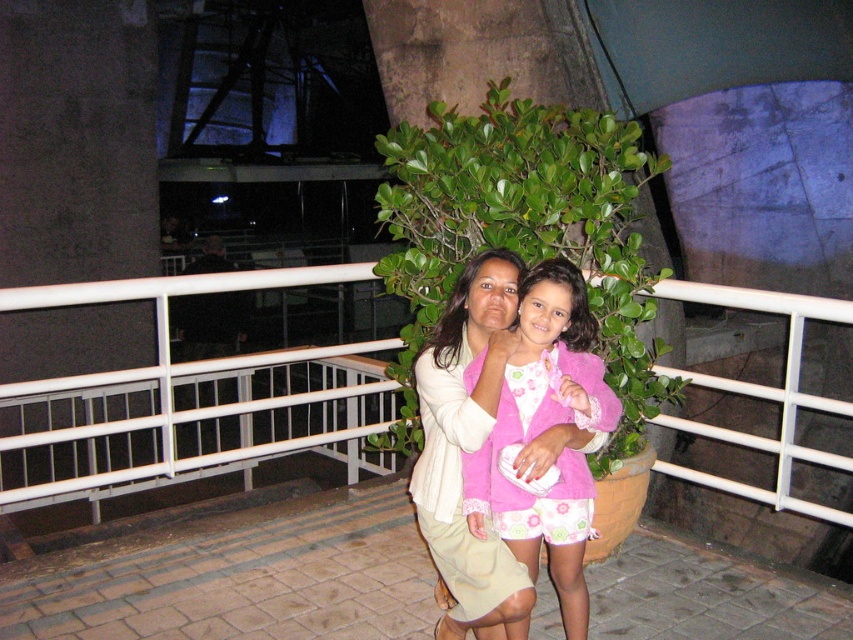
Consider the image. Which of these two, pink fuzzy jacket at center or light beige fabric jacket at center, stands taller?

light beige fabric jacket at center

Where is `pink fuzzy jacket at center`? The image size is (853, 640). pink fuzzy jacket at center is located at coordinates [x=543, y=429].

Locate an element on the screen. This screenshot has width=853, height=640. pink fuzzy jacket at center is located at coordinates (543, 429).

Is point (231, 467) positioned before point (485, 273)?

No, (231, 467) is behind (485, 273).

Is white metal balustrade at center to the left of light beige fabric jacket at center from the viewer's perspective?

Indeed, white metal balustrade at center is positioned on the left side of light beige fabric jacket at center.

You are a GUI agent. You are given a task and a screenshot of the screen. Output one action in this format:
    pyautogui.click(x=<x>, y=<y>)
    Task: Click on the white metal balustrade at center
    
    Given the screenshot: What is the action you would take?
    pyautogui.click(x=187, y=384)

Image resolution: width=853 pixels, height=640 pixels. I want to click on white metal balustrade at center, so click(x=187, y=384).

Is white metal balustrade at center in front of pink fuzzy jacket at center?

No, white metal balustrade at center is behind pink fuzzy jacket at center.

Can you confirm if white metal balustrade at center is positioned to the left of pink fuzzy jacket at center?

Yes, white metal balustrade at center is to the left of pink fuzzy jacket at center.

The image size is (853, 640). What are the coordinates of `white metal balustrade at center` in the screenshot? It's located at (187, 384).